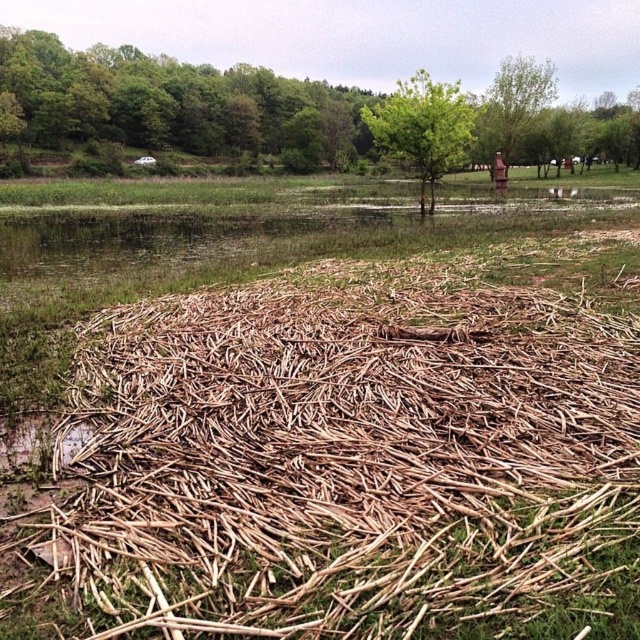
You are standing at the point marked by the coordinates (x=346, y=454) in the image. Looking around, you see a brown wood reed at center. What is directly in front of you?

The point marked by the coordinates (x=346, y=454) indicates that you are standing at the location of the brown wood reed at center, so the reed is directly in front of you.

You are standing in the outdoor scene and want to take a photo of both the brown wood reed at center and the green leafy tree at center. Which object should you focus on first to ensure both are in clear view?

You should focus on the brown wood reed at center first since it is closer to you than the green leafy tree at center, allowing both to be in focus when using a camera with a fixed focal point.

In the scene shown: You are an environmental scientist observing the scene. You need to determine which tree has a wider canopy between the green leafy tree at upper center and the green leafy tree at center. Which one do you think has a wider canopy?

The green leafy tree at upper center has a wider canopy than the green leafy tree at center.